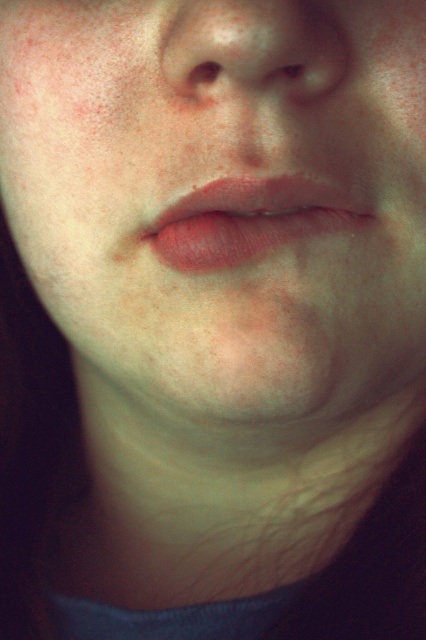
Who is shorter, smooth skin at center or matte pink lips at center?

matte pink lips at center

Who is positioned more to the left, smooth skin at center or matte pink lips at center?

From the viewer's perspective, smooth skin at center appears more on the left side.

Which is in front, point (13, 124) or point (201, 200)?

Point (201, 200) is more forward.

The width and height of the screenshot is (426, 640). Find the location of `smooth skin at center`. smooth skin at center is located at coordinates (222, 196).

What do you see at coordinates (222, 196) in the screenshot?
I see `smooth skin at center` at bounding box center [222, 196].

Is smooth skin at center positioned before smooth skin nose at center?

Yes, it is.

Is point (351, 385) less distant than point (327, 42)?

No, it is not.

Locate an element on the screen. Image resolution: width=426 pixels, height=640 pixels. smooth skin at center is located at coordinates (222, 196).

Between matte pink lips at center and matte skin eye at upper center, which one has more height?

matte pink lips at center is taller.

Can you confirm if matte pink lips at center is bigger than matte skin eye at upper center?

Yes, matte pink lips at center is bigger than matte skin eye at upper center.

Find the location of `matte pink lips at center`. matte pink lips at center is located at coordinates (250, 220).